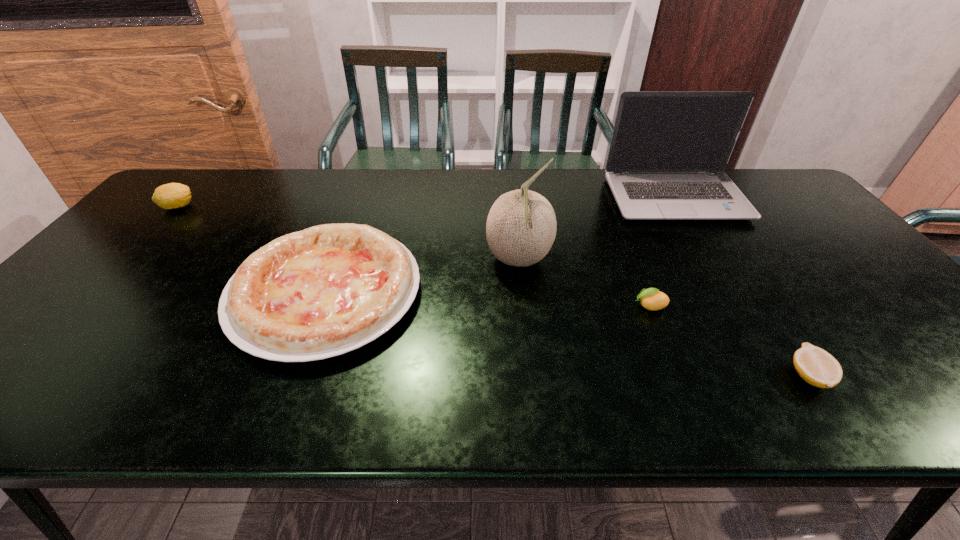
Locate an element on the screen. Image resolution: width=960 pixels, height=540 pixels. empty space between the leftmost lemon and the pizza is located at coordinates (252, 250).

Locate an element on the screen. This screenshot has height=540, width=960. free space between the leftmost object and the rightmost lemon is located at coordinates (493, 292).

You are a GUI agent. You are given a task and a screenshot of the screen. Output one action in this format:
    pyautogui.click(x=<x>, y=<y>)
    Task: Click on the vacant point located between the fifth object from right to left and the rightmost lemon
    The width and height of the screenshot is (960, 540).
    Given the screenshot: What is the action you would take?
    pyautogui.click(x=567, y=335)

Identify the location of free area in between the cantaloup and the laptop computer. (597, 230).

Select which object is the fourth closest to the rightmost lemon. Please provide its 2D coordinates. Your answer should be formatted as a tuple, i.e. [(x, y)], where the tuple contains the x and y coordinates of a point satisfying the conditions above.

[(329, 289)]

Select which object appears as the closest to the second lemon from right to left. Please provide its 2D coordinates. Your answer should be formatted as a tuple, i.e. [(x, y)], where the tuple contains the x and y coordinates of a point satisfying the conditions above.

[(521, 226)]

This screenshot has height=540, width=960. I want to click on lemon object that ranks as the closest to the nearest lemon, so click(x=652, y=299).

Find the location of `the third closest lemon to the pizza`. the third closest lemon to the pizza is located at coordinates (817, 367).

What are the coordinates of `vacant space that satisfies the following two spatial constraints: 1. on the screen of the nearest lemon; 2. on the right side of the laptop computer` in the screenshot? It's located at (784, 376).

At what (x,y) coordinates should I click in order to perform the action: click on free region that satisfies the following two spatial constraints: 1. at the stem end of the leftmost object; 2. on the right side of the fifth object from right to left. Please return your answer as a coordinate pair (x, y). The height and width of the screenshot is (540, 960). Looking at the image, I should click on 98,293.